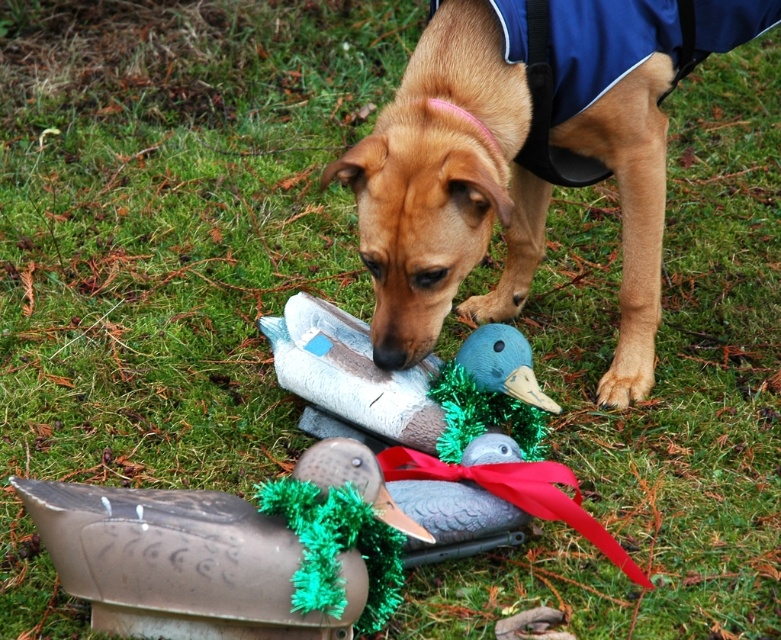
You are a dog owner who wants to ensure your brown matte dog at center stays within a 30 inch safety zone around the metallic duck at lower center. Based on the scene, is your dog currently within the safety zone?

The brown matte dog at center is 30.94 inches away from the metallic duck at lower center, which exceeds the 30 inch safety zone. Therefore, the dog is currently outside the safety zone.